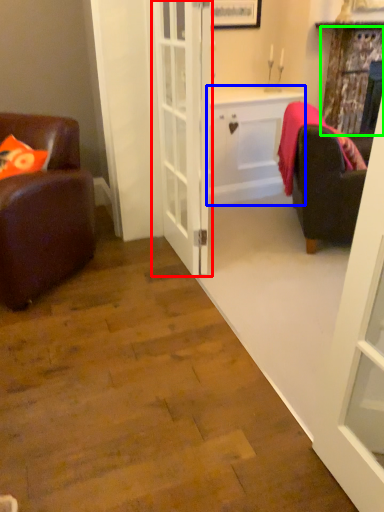
Question: Considering the real-world distances, which object is farthest from door (highlighted by a red box)? cabinetry (highlighted by a blue box) or curtain (highlighted by a green box)?

Choices:
 (A) cabinetry
 (B) curtain

Answer: (B)